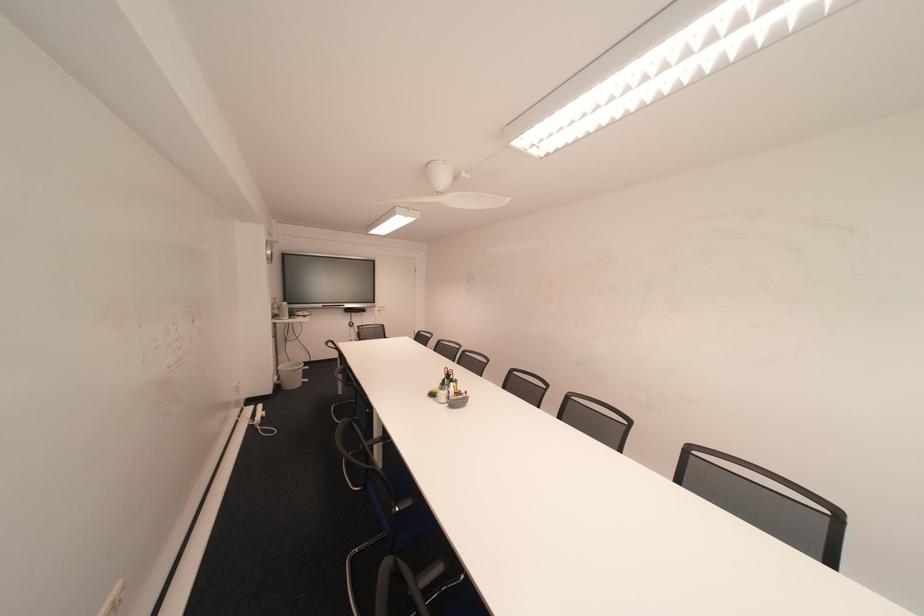
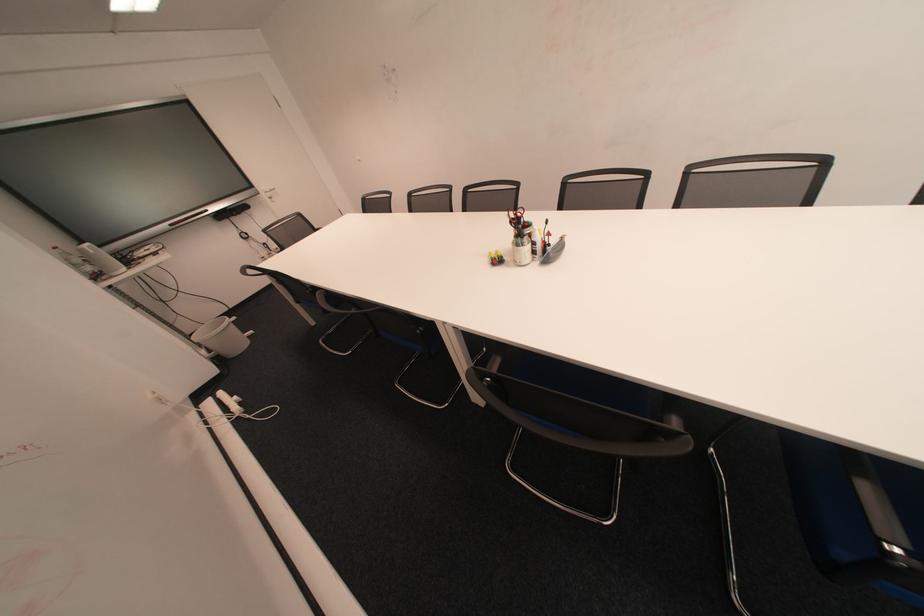
Find the pixel in the second image that matches [457,406] in the first image.

(550, 262)